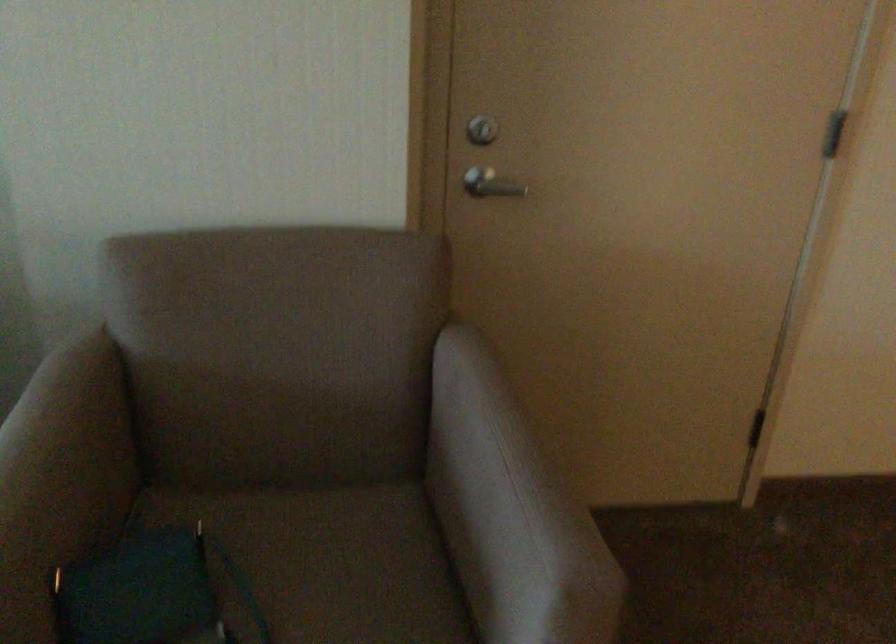
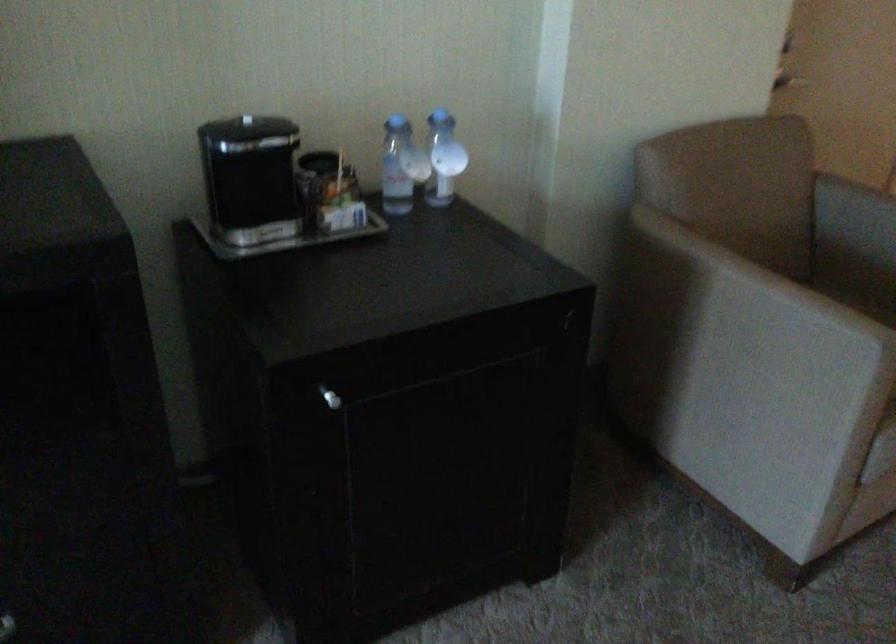
Where in the second image is the point corresponding to (364,544) from the first image?

(859, 303)